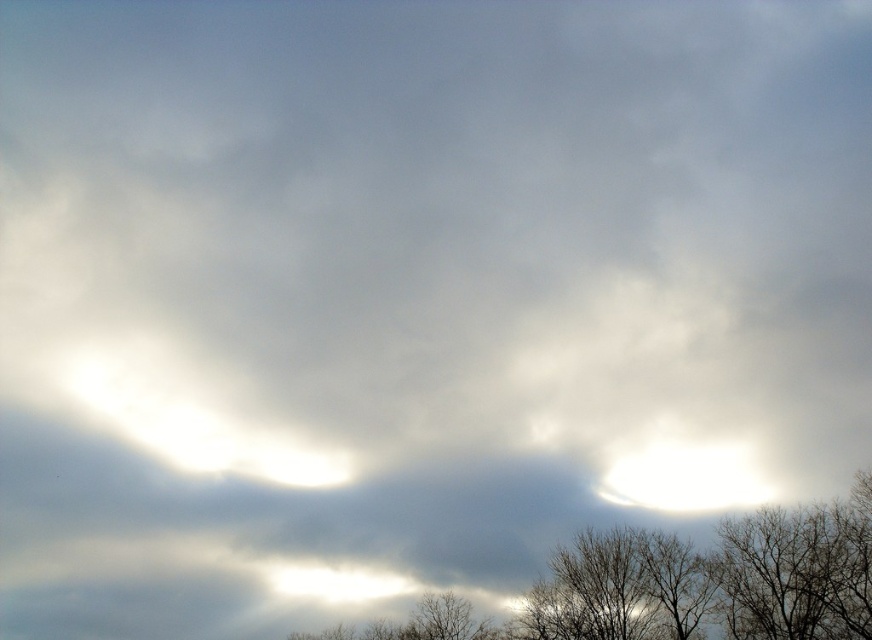
Question: Considering the relative positions of bare branches at lower center and bare branches at lower right in the image provided, where is bare branches at lower center located with respect to bare branches at lower right?

Choices:
 (A) below
 (B) above

Answer: (A)

Question: Which point is farther to the camera?

Choices:
 (A) (740, 557)
 (B) (775, 589)

Answer: (A)

Question: Which object is farther from the camera taking this photo?

Choices:
 (A) bare branches at lower right
 (B) bare branches at lower center

Answer: (A)

Question: Which point is farther to the camera?

Choices:
 (A) (714, 579)
 (B) (804, 548)

Answer: (A)

Question: Is the position of bare branches at lower center more distant than that of bare branches at lower right?

Choices:
 (A) no
 (B) yes

Answer: (A)

Question: Is bare branches at lower center below bare branches at lower right?

Choices:
 (A) yes
 (B) no

Answer: (A)